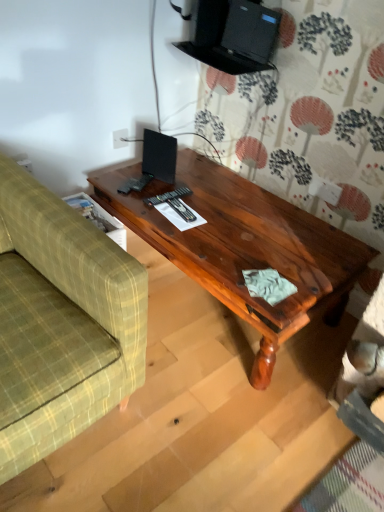
This screenshot has height=512, width=384. In order to click on green plaid fabric couch at left in this screenshot , I will do `click(61, 322)`.

What do you see at coordinates (61, 322) in the screenshot?
I see `green plaid fabric couch at left` at bounding box center [61, 322].

What do you see at coordinates (245, 248) in the screenshot? I see `shiny brown wood coffee table at center` at bounding box center [245, 248].

Measure the distance between point (235,202) and camera.

A distance of 1.76 meters exists between point (235,202) and camera.

The height and width of the screenshot is (512, 384). Identify the location of shiny brown wood coffee table at center. point(245,248).

What is the approximate width of shiny brown wood coffee table at center?

The width of shiny brown wood coffee table at center is 24.17 inches.

The height and width of the screenshot is (512, 384). In order to click on green plaid fabric couch at left in this screenshot , I will do `click(61, 322)`.

Can you confirm if shiny brown wood coffee table at center is positioned to the right of green plaid fabric couch at left?

Correct, you'll find shiny brown wood coffee table at center to the right of green plaid fabric couch at left.

Does shiny brown wood coffee table at center lie in front of green plaid fabric couch at left?

That is False.

Which is in front, point (323, 283) or point (69, 419)?

The point (69, 419) is closer.

From the image's perspective, is shiny brown wood coffee table at center above or below green plaid fabric couch at left?

Clearly, from the image's perspective, shiny brown wood coffee table at center is above green plaid fabric couch at left.

In the scene shown: From a real-world perspective, who is located lower, shiny brown wood coffee table at center or green plaid fabric couch at left?

shiny brown wood coffee table at center is physically lower.

Is shiny brown wood coffee table at center wider or thinner than green plaid fabric couch at left?

shiny brown wood coffee table at center is thinner than green plaid fabric couch at left.

In terms of height, does shiny brown wood coffee table at center look taller or shorter compared to green plaid fabric couch at left?

In the image, shiny brown wood coffee table at center appears to be shorter than green plaid fabric couch at left.

Which of these two, shiny brown wood coffee table at center or green plaid fabric couch at left, is smaller?

shiny brown wood coffee table at center.

Would you say shiny brown wood coffee table at center is outside green plaid fabric couch at left?

Indeed, shiny brown wood coffee table at center is completely outside green plaid fabric couch at left.

Is shiny brown wood coffee table at center far from green plaid fabric couch at left?

shiny brown wood coffee table at center is actually quite close to green plaid fabric couch at left.

Does shiny brown wood coffee table at center turn towards green plaid fabric couch at left?

Yes, shiny brown wood coffee table at center faces towards green plaid fabric couch at left.

You are a GUI agent. You are given a task and a screenshot of the screen. Output one action in this format:
    pyautogui.click(x=<x>, y=<y>)
    Task: Click on the studio couch below the shiny brown wood coffee table at center (from the image's perspective)
    The height and width of the screenshot is (512, 384).
    Given the screenshot: What is the action you would take?
    pyautogui.click(x=61, y=322)

Between green plaid fabric couch at left and shiny brown wood coffee table at center, which one appears on the left side from the viewer's perspective?

From the viewer's perspective, green plaid fabric couch at left appears more on the left side.

Considering their positions, is green plaid fabric couch at left located in front of or behind shiny brown wood coffee table at center?

In the image, green plaid fabric couch at left appears in front of shiny brown wood coffee table at center.

Considering the positions of points (32, 413) and (280, 252), is point (32, 413) farther from camera compared to point (280, 252)?

No.

From the image's perspective, is green plaid fabric couch at left above or below shiny brown wood coffee table at center?

From the image's perspective, green plaid fabric couch at left appears below shiny brown wood coffee table at center.

From a real-world perspective, between green plaid fabric couch at left and shiny brown wood coffee table at center, who is vertically lower?

shiny brown wood coffee table at center.

Considering the sizes of objects green plaid fabric couch at left and shiny brown wood coffee table at center in the image provided, who is wider, green plaid fabric couch at left or shiny brown wood coffee table at center?

Wider between the two is green plaid fabric couch at left.

Which of these two, green plaid fabric couch at left or shiny brown wood coffee table at center, stands shorter?

With less height is shiny brown wood coffee table at center.

Can you confirm if green plaid fabric couch at left is bigger than shiny brown wood coffee table at center?

Indeed, green plaid fabric couch at left has a larger size compared to shiny brown wood coffee table at center.

Is green plaid fabric couch at left inside the boundaries of shiny brown wood coffee table at center, or outside?

green plaid fabric couch at left is not inside shiny brown wood coffee table at center, it's outside.

Consider the image. Does green plaid fabric couch at left touch shiny brown wood coffee table at center?

green plaid fabric couch at left and shiny brown wood coffee table at center are not in contact.

Is green plaid fabric couch at left positioned with its back to shiny brown wood coffee table at center?

No, green plaid fabric couch at left is not facing the opposite direction of shiny brown wood coffee table at center.

How distant is green plaid fabric couch at left from shiny brown wood coffee table at center?

They are 21.43 inches apart.

Locate an element on the screen. This screenshot has height=512, width=384. coffee table behind the green plaid fabric couch at left is located at coordinates [x=245, y=248].

Where is `studio couch in front of the shiny brown wood coffee table at center`? This screenshot has height=512, width=384. studio couch in front of the shiny brown wood coffee table at center is located at coordinates (61, 322).

Locate an element on the screen. This screenshot has height=512, width=384. studio couch that appears below the shiny brown wood coffee table at center (from the image's perspective) is located at coordinates (61, 322).